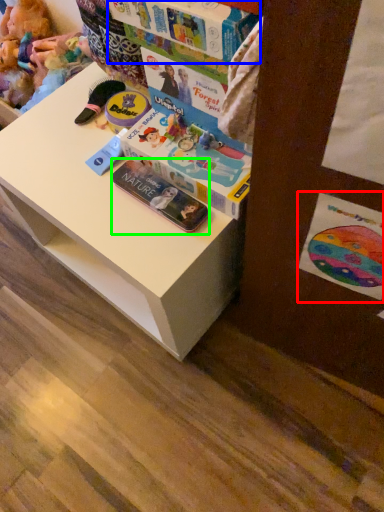
Question: Considering the real-world distances, which object is farthest from postcard (highlighted by a red box)? book (highlighted by a blue box) or paperback book (highlighted by a green box)?

Choices:
 (A) book
 (B) paperback book

Answer: (A)